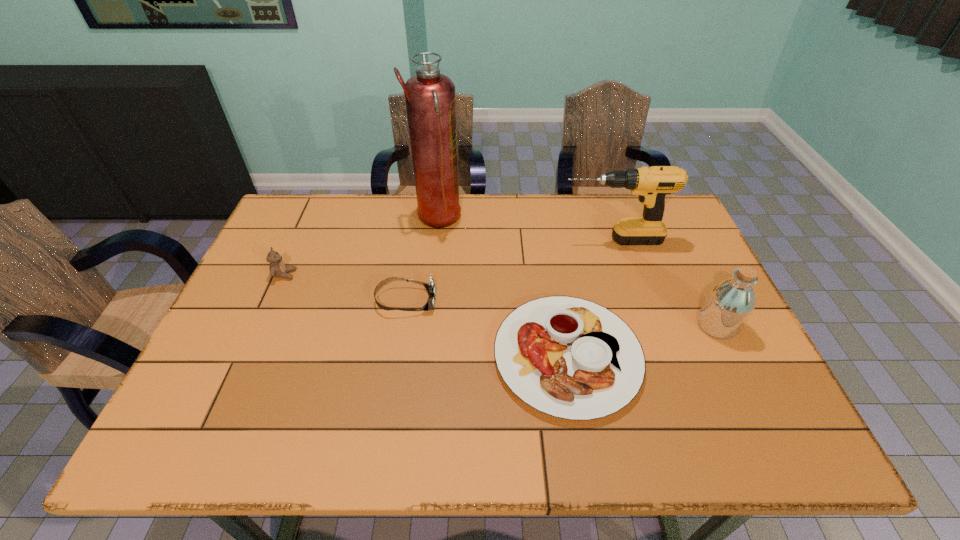
Where is `free space that satisfies the following two spatial constraints: 1. on the front-facing side of the platter; 2. on the right side of the goggles`? free space that satisfies the following two spatial constraints: 1. on the front-facing side of the platter; 2. on the right side of the goggles is located at coordinates (396, 356).

I want to click on vacant space that satisfies the following two spatial constraints: 1. on the front-facing side of the second shortest object; 2. on the back side of the fourth shortest object, so click(401, 326).

Where is `free space that satisfies the following two spatial constraints: 1. on the front-facing side of the teddy bear; 2. on the back side of the platter`? This screenshot has width=960, height=540. free space that satisfies the following two spatial constraints: 1. on the front-facing side of the teddy bear; 2. on the back side of the platter is located at coordinates point(249,356).

What are the coordinates of `vacant area that satisfies the following two spatial constraints: 1. at the tip of the bottle; 2. on the right side of the drill` in the screenshot? It's located at (639, 326).

Locate an element on the screen. The image size is (960, 540). free space that satisfies the following two spatial constraints: 1. at the tip of the fourth shortest object; 2. on the right side of the drill is located at coordinates (639, 326).

You are a GUI agent. You are given a task and a screenshot of the screen. Output one action in this format:
    pyautogui.click(x=<x>, y=<y>)
    Task: Click on the blank space that satisfies the following two spatial constraints: 1. on the front-facing side of the shortest object; 2. on the right side of the leftmost object
    This screenshot has width=960, height=540.
    Given the screenshot: What is the action you would take?
    pyautogui.click(x=249, y=356)

At what (x,y) coordinates should I click in order to perform the action: click on free space that satisfies the following two spatial constraints: 1. on the front-facing side of the platter; 2. on the right side of the teddy bear. Please return your answer as a coordinate pair (x, y). The height and width of the screenshot is (540, 960). Looking at the image, I should click on pos(249,356).

Image resolution: width=960 pixels, height=540 pixels. Identify the location of free spot that satisfies the following two spatial constraints: 1. on the front-facing side of the leftmost object; 2. on the back side of the platter. (249, 356).